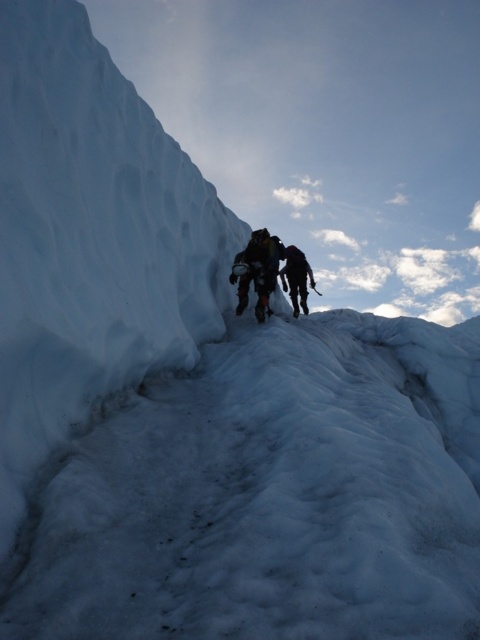
Question: Is black fabric backpack at center positioned before dark gray fabric jacket at center?

Choices:
 (A) no
 (B) yes

Answer: (B)

Question: Which object appears closest to the camera in this image?

Choices:
 (A) dark gray fabric jacket at center
 (B) black fabric backpack at center

Answer: (B)

Question: Does black fabric backpack at center lie in front of dark gray fabric jacket at center?

Choices:
 (A) yes
 (B) no

Answer: (A)

Question: Which point appears farthest from the camera in this image?

Choices:
 (A) (267, 285)
 (B) (287, 244)

Answer: (B)

Question: Which object is closer to the camera taking this photo?

Choices:
 (A) black fabric backpack at center
 (B) dark gray fabric jacket at center

Answer: (A)

Question: Can you confirm if black fabric backpack at center is positioned to the right of dark gray fabric jacket at center?

Choices:
 (A) yes
 (B) no

Answer: (B)